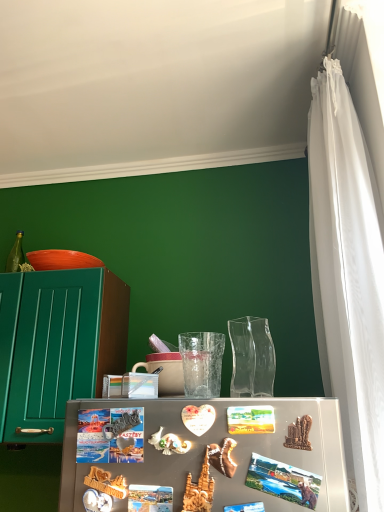
Locate an element on the screen. transparent textured glass at center is located at coordinates (202, 362).

What do you see at coordinates (165, 372) in the screenshot? Image resolution: width=384 pixels, height=512 pixels. I see `matte ceramic mug at center` at bounding box center [165, 372].

In order to click on metallic photo magnet at center in this screenshot , I will do `click(283, 481)`.

Describe the element at coordinates (283, 481) in the screenshot. The image size is (384, 512). I see `metallic photo magnet at center` at that location.

At what (x,y) coordinates should I click in order to perform the action: click on transparent textured glass at center. Please return your answer as a coordinate pair (x, y). This screenshot has height=512, width=384. Looking at the image, I should click on (202, 362).

Considering the relative positions of green matte cabinet at left and transparent textured glass at center in the image provided, is green matte cabinet at left to the left or to the right of transparent textured glass at center?

Clearly, green matte cabinet at left is on the left of transparent textured glass at center in the image.

Is green matte cabinet at left not close to transparent textured glass at center?

green matte cabinet at left is actually quite close to transparent textured glass at center.

Is green matte cabinet at left oriented towards transparent textured glass at center?

No.

From the image's perspective, is green matte cabinet at left on top of transparent textured glass at center?

Incorrect, from the image's perspective, green matte cabinet at left is lower than transparent textured glass at center.

From their relative heights in the image, would you say metallic photo magnet at center is taller or shorter than orange matte bowl at upper left?

In the image, metallic photo magnet at center appears to be taller than orange matte bowl at upper left.

Could you tell me if metallic photo magnet at center is turned towards orange matte bowl at upper left?

No, metallic photo magnet at center does not turn towards orange matte bowl at upper left.

Is metallic photo magnet at center directly adjacent to orange matte bowl at upper left?

metallic photo magnet at center and orange matte bowl at upper left are not in contact.

From a real-world perspective, is orange matte bowl at upper left located beneath white sheer curtain at right?

No, from a real-world perspective, orange matte bowl at upper left is not below white sheer curtain at right.

Is orange matte bowl at upper left bigger than white sheer curtain at right?

No, orange matte bowl at upper left is not bigger than white sheer curtain at right.

You are a GUI agent. You are given a task and a screenshot of the screen. Output one action in this format:
    pyautogui.click(x=<x>, y=<y>)
    Task: Click on the bowl lying above the white sheer curtain at right (from the image's perspective)
    The height and width of the screenshot is (512, 384).
    Given the screenshot: What is the action you would take?
    pyautogui.click(x=62, y=260)

From a real-world perspective, is matte ceramic mug at center physically located above or below metallic photo magnet at center?

From a real-world perspective, matte ceramic mug at center is physically above metallic photo magnet at center.

Between matte ceramic mug at center and metallic photo magnet at center, which one has more height?

matte ceramic mug at center.

Is metallic photo magnet at center a part of matte ceramic mug at center?

No, metallic photo magnet at center is not inside matte ceramic mug at center.

Is matte ceramic mug at center oriented away from metallic photo magnet at center?

No.

Is orange matte bowl at upper left positioned behind green matte cabinet at left?

Yes, orange matte bowl at upper left is behind green matte cabinet at left.

From a real-world perspective, who is located lower, orange matte bowl at upper left or green matte cabinet at left?

green matte cabinet at left.

Is orange matte bowl at upper left facing towards green matte cabinet at left?

No, orange matte bowl at upper left is not turned towards green matte cabinet at left.

Considering the sizes of orange matte bowl at upper left and green matte cabinet at left in the image, is orange matte bowl at upper left wider or thinner than green matte cabinet at left?

orange matte bowl at upper left is thinner than green matte cabinet at left.

The height and width of the screenshot is (512, 384). Find the location of `glass vase to the right of orange matte bowl at upper left`. glass vase to the right of orange matte bowl at upper left is located at coordinates (252, 357).

Is orange matte bowl at upper left inside or outside of transparent glass vase at center?

orange matte bowl at upper left is located beyond the bounds of transparent glass vase at center.

Is transparent glass vase at center at the back of orange matte bowl at upper left?

orange matte bowl at upper left is not turned away from transparent glass vase at center.

Is orange matte bowl at upper left with transparent glass vase at center?

They are not placed beside each other.

Does point (274, 355) come closer to viewer compared to point (188, 391)?

No.

Is transparent glass vase at center facing towards transparent textured glass at center?

No, transparent glass vase at center is not turned towards transparent textured glass at center.

The height and width of the screenshot is (512, 384). Identify the location of glass vase in front of the transparent textured glass at center. (252, 357).

From a real-world perspective, who is located lower, transparent glass vase at center or transparent textured glass at center?

transparent textured glass at center is physically lower.

Image resolution: width=384 pixels, height=512 pixels. I want to click on cabinetry below the transparent textured glass at center (from the image's perspective), so click(63, 347).

You are a GUI agent. You are given a task and a screenshot of the screen. Output one action in this format:
    pyautogui.click(x=<x>, y=<y>)
    Task: Click on the magnet on the right of the orange matte bowl at upper left
    This screenshot has width=384, height=512.
    Given the screenshot: What is the action you would take?
    pyautogui.click(x=283, y=481)

Looking at the image, which one is located closer to green matte cabinet at left, matte ceramic mug at center or transparent glass vase at center?

Based on the image, matte ceramic mug at center appears to be nearer to green matte cabinet at left.

Estimate the real-world distances between objects in this image. Which object is closer to white sheer curtain at right, transparent glass vase at center or metallic photo magnet at center?

Among the two, transparent glass vase at center is located nearer to white sheer curtain at right.

Estimate the real-world distances between objects in this image. Which object is closer to transparent textured glass at center, metallic photo magnet at center or orange matte bowl at upper left?

Among the two, metallic photo magnet at center is located nearer to transparent textured glass at center.

Which object lies further to the anchor point metallic photo magnet at center, transparent glass vase at center or matte ceramic mug at center?

The object further to metallic photo magnet at center is transparent glass vase at center.

Looking at the image, which one is located closer to orange matte bowl at upper left, metallic photo magnet at center or transparent glass vase at center?

Among the two, transparent glass vase at center is located nearer to orange matte bowl at upper left.

Considering their positions, is orange matte bowl at upper left positioned closer to green matte cabinet at left than white sheer curtain at right?

orange matte bowl at upper left is positioned closer to the anchor green matte cabinet at left.

Considering their positions, is matte ceramic mug at center positioned closer to transparent glass vase at center than metallic photo magnet at center?

Among the two, matte ceramic mug at center is located nearer to transparent glass vase at center.

Which object lies nearer to the anchor point transparent glass vase at center, matte ceramic mug at center or orange matte bowl at upper left?

matte ceramic mug at center is positioned closer to the anchor transparent glass vase at center.

Find the location of a particular element. This screenshot has height=512, width=384. bowl between green matte cabinet at left and white sheer curtain at right from left to right is located at coordinates (62, 260).

Find the location of a particular element. glass vase located between metallic photo magnet at center and transparent textured glass at center in the depth direction is located at coordinates (252, 357).

The height and width of the screenshot is (512, 384). In order to click on glass vase between transparent textured glass at center and white sheer curtain at right from left to right in this screenshot , I will do `click(252, 357)`.

Locate an element on the screen. This screenshot has height=512, width=384. magnet between white sheer curtain at right and orange matte bowl at upper left from front to back is located at coordinates coord(283,481).